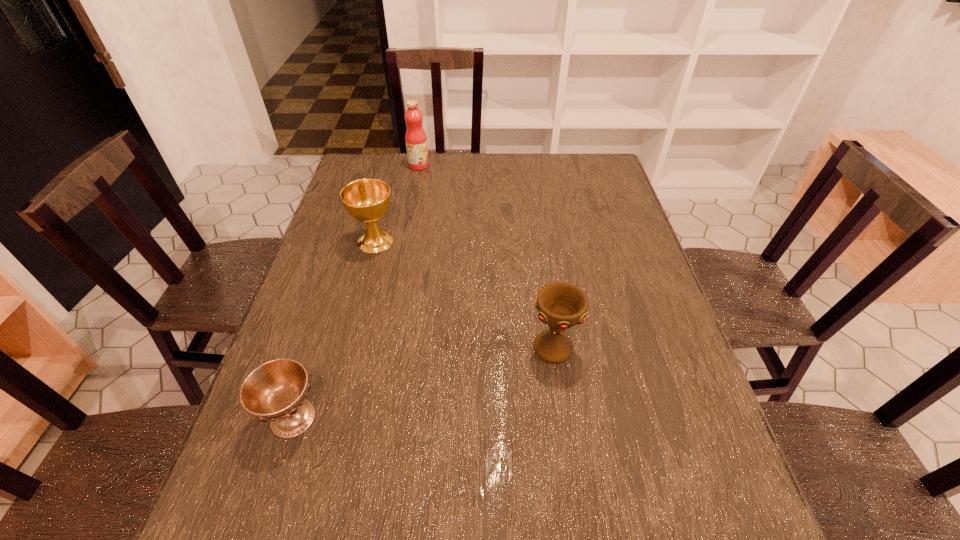
Image resolution: width=960 pixels, height=540 pixels. What are the coordinates of `vacant area between the rightmost object and the farthest chalice` in the screenshot? It's located at (465, 295).

You are a GUI agent. You are given a task and a screenshot of the screen. Output one action in this format:
    pyautogui.click(x=<x>, y=<y>)
    Task: Click on the empty space between the nearest object and the farthest chalice
    
    Given the screenshot: What is the action you would take?
    (334, 329)

Identify the location of vacant area that lies between the rightmost chalice and the shortest chalice. This screenshot has height=540, width=960. (423, 383).

This screenshot has height=540, width=960. In order to click on vacant point located between the nearest object and the tallest object in this screenshot , I will do `click(356, 292)`.

The image size is (960, 540). I want to click on vacant area between the farthest chalice and the tallest object, so click(397, 203).

At what (x,y) coordinates should I click in order to perform the action: click on object that can be found as the third closest to the rightmost object. Please return your answer as a coordinate pair (x, y). The image size is (960, 540). Looking at the image, I should click on (416, 140).

Select which object appears as the second closest to the rightmost object. Please provide its 2D coordinates. Your answer should be formatted as a tuple, i.e. [(x, y)], where the tuple contains the x and y coordinates of a point satisfying the conditions above.

[(367, 200)]

Find the location of a particular element. The image size is (960, 540). chalice that stands as the closest to the rightmost object is located at coordinates (276, 391).

The image size is (960, 540). Find the location of `chalice that is the second nearest to the third nearest object`. chalice that is the second nearest to the third nearest object is located at coordinates pyautogui.click(x=561, y=305).

Locate an element on the screen. free space that satisfies the following two spatial constraints: 1. on the front label of the farthest object; 2. on the front side of the farthest chalice is located at coordinates (405, 241).